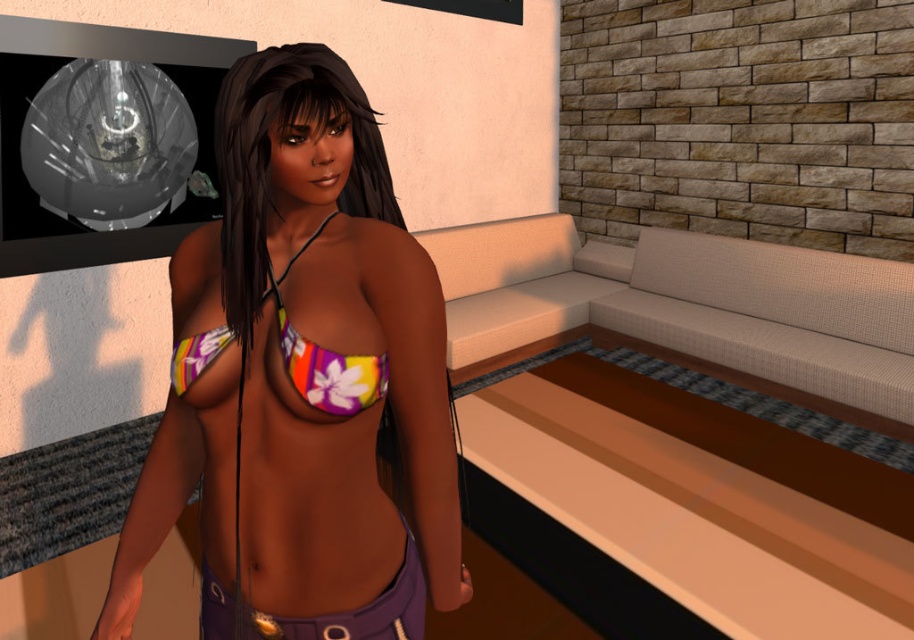
Which is more to the right, floral fabric bikini top at center or multicolored fabric bikini top at center?

multicolored fabric bikini top at center

Between point (283, 179) and point (333, 392), which one is positioned in front?

Point (333, 392)

Who is more distant from viewer, (407, 364) or (291, 336)?

Positioned behind is point (407, 364).

Locate an element on the screen. floral fabric bikini top at center is located at coordinates (301, 380).

From the picture: Does black matte hair at center have a smaller size compared to purple fabric shorts at lower center?

Incorrect, black matte hair at center is not smaller in size than purple fabric shorts at lower center.

Is point (392, 188) positioned before point (389, 634)?

No, it is not.

What are the coordinates of `black matte hair at center` in the screenshot? It's located at (270, 157).

Between multicolored fabric bikini top at center and purple fabric shorts at lower center, which one appears on the left side from the viewer's perspective?

multicolored fabric bikini top at center is more to the left.

Which of these two, multicolored fabric bikini top at center or purple fabric shorts at lower center, stands taller?

Standing taller between the two is multicolored fabric bikini top at center.

What do you see at coordinates (324, 358) in the screenshot? The height and width of the screenshot is (640, 914). I see `multicolored fabric bikini top at center` at bounding box center [324, 358].

Where is `multicolored fabric bikini top at center`? multicolored fabric bikini top at center is located at coordinates (324, 358).